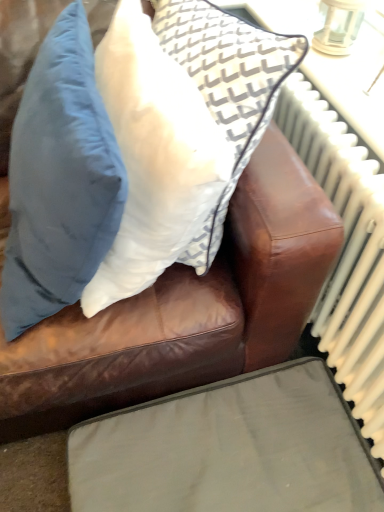
Where is `free space above white metallic radiator at right (from a real-world perspective)`? This screenshot has height=512, width=384. free space above white metallic radiator at right (from a real-world perspective) is located at coordinates pos(354,151).